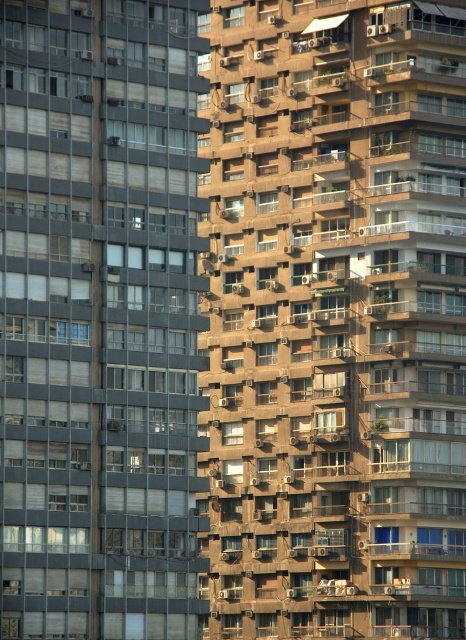
Question: Does brown concrete building at center appear under matte glass windows at left?

Choices:
 (A) yes
 (B) no

Answer: (B)

Question: Does brown concrete building at center have a greater width compared to matte glass windows at left?

Choices:
 (A) yes
 (B) no

Answer: (A)

Question: Is brown concrete building at center above matte glass windows at left?

Choices:
 (A) yes
 (B) no

Answer: (A)

Question: Among these points, which one is nearest to the camera?

Choices:
 (A) (128, 36)
 (B) (315, 356)

Answer: (A)